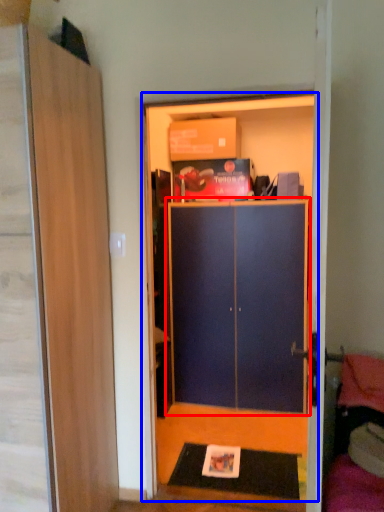
Question: Among these objects, which one is farthest to the camera, cabinetry (highlighted by a red box) or dresser (highlighted by a blue box)?

Choices:
 (A) cabinetry
 (B) dresser

Answer: (A)